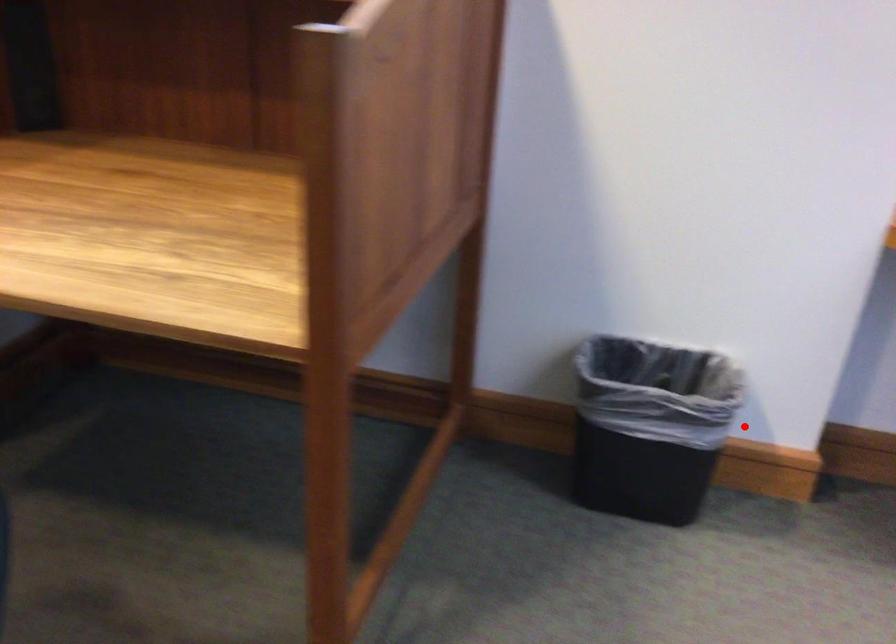
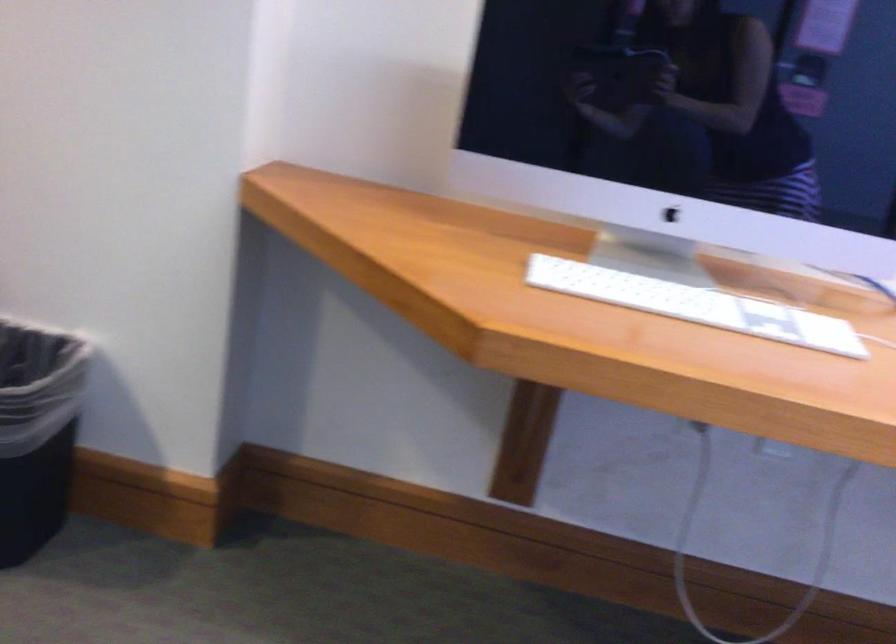
Question: I am providing you with two images of the same scene from different viewpoints. A red point is shown in image1. For the corresponding object point in image2, is it positioned nearer or farther from the camera?

Choices:
 (A) Nearer
 (B) Farther

Answer: (A)